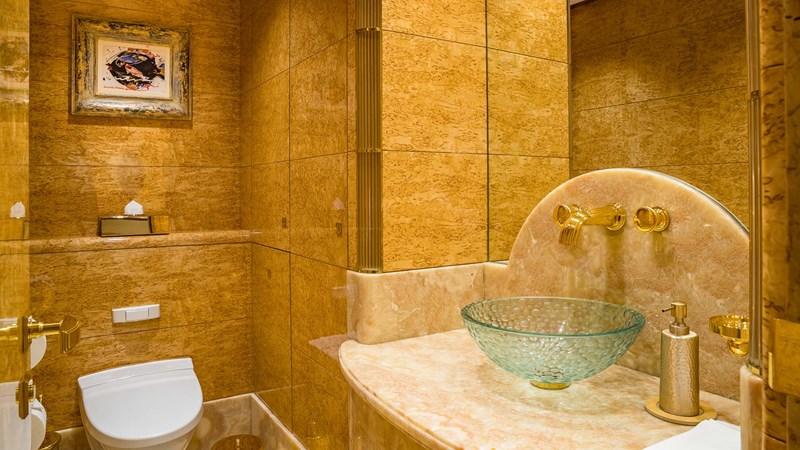
Image resolution: width=800 pixels, height=450 pixels. Find the location of `wall tile`. wall tile is located at coordinates (294, 132).